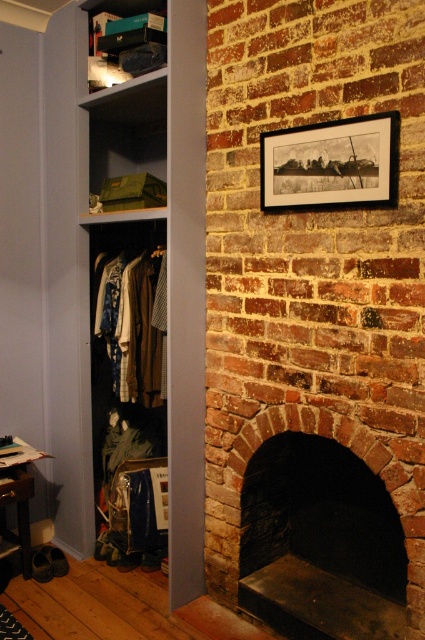
You are an interior designer planning to hang a large painting. You have two options for placement in the scene described. The first option is to place it above the matte gray bookshelf at center, and the second is to place it above the brick fireplace at center. Which location would allow the painting to be placed higher up on the wall?

The matte gray bookshelf at center is located above the brick fireplace at center, so placing the painting above the brick fireplace at center would allow it to be placed higher up on the wall.

You are organizing the wardrobe and need to place a new item between the matte brown coat at left and the matte black shoebox at upper left. Where should you place it?

Place the new item between the matte brown coat at left and the matte black shoebox at upper left. Since the matte brown coat at left is located below the matte black shoebox at upper left, the new item should be placed above the coat but below the shoebox to maintain the vertical order.

You are standing in the room and want to hang a small picture frame. The frame is 1 foot tall. You have two options to hang it either on the brick fireplace at center or the matte brown coat at left. Which object can accommodate the frame without the frame touching the floor?

The brick fireplace at center is much taller than the matte brown coat at left, so hanging the small picture frame on the brick fireplace at center would ensure it doesn t touch the floor.